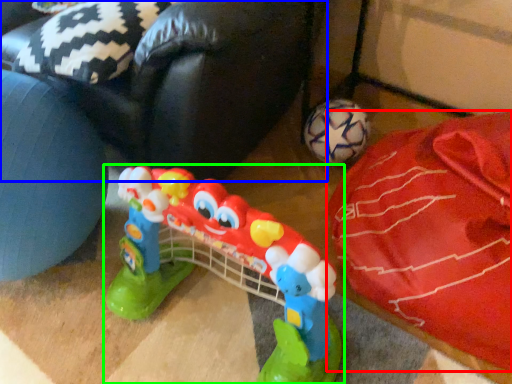
Question: Which is farther away from material (highlighted by a red box)? bean bag chair (highlighted by a blue box) or toy (highlighted by a green box)?

Choices:
 (A) bean bag chair
 (B) toy

Answer: (A)